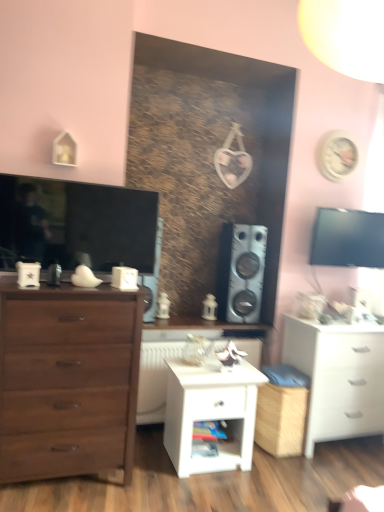
Question: Which is correct: matte brown chest of drawers at left, acting as the second chest of drawers starting from the right, is inside black glossy tv at upper right, or outside of it?

Choices:
 (A) outside
 (B) inside

Answer: (A)

Question: From their relative heights in the image, would you say matte brown chest of drawers at left, which ranks as the first chest of drawers in front-to-back order, is taller or shorter than black glossy tv at upper right?

Choices:
 (A) tall
 (B) short

Answer: (A)

Question: Which object is the closest to the white matte chest of drawers at lower right, acting as the first chest of drawers starting from the back?

Choices:
 (A) wooden shelf at center
 (B) black glossy tv at upper right
 (C) white plastic radiator at center
 (D) metallic silver speaker at center-right
 (E) matte black television at left

Answer: (D)

Question: Which is farther from the matte black television at left?

Choices:
 (A) matte brown chest of drawers at left, which ranks as the first chest of drawers in front-to-back order
 (B) black glossy tv at upper right
 (C) wooden shelf at center
 (D) white plastic radiator at center
 (E) metallic silver speaker at center-right

Answer: (B)